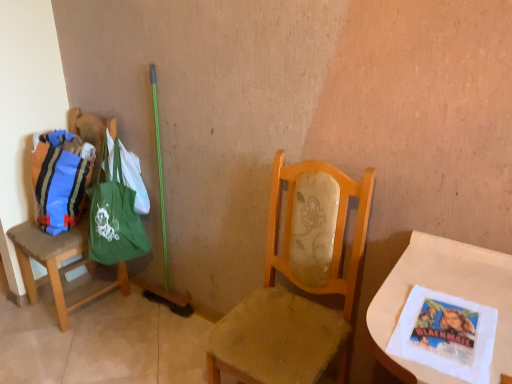
Image resolution: width=512 pixels, height=384 pixels. I want to click on vacant space underneath green canvas tote at left (from a real-world perspective), so click(x=133, y=308).